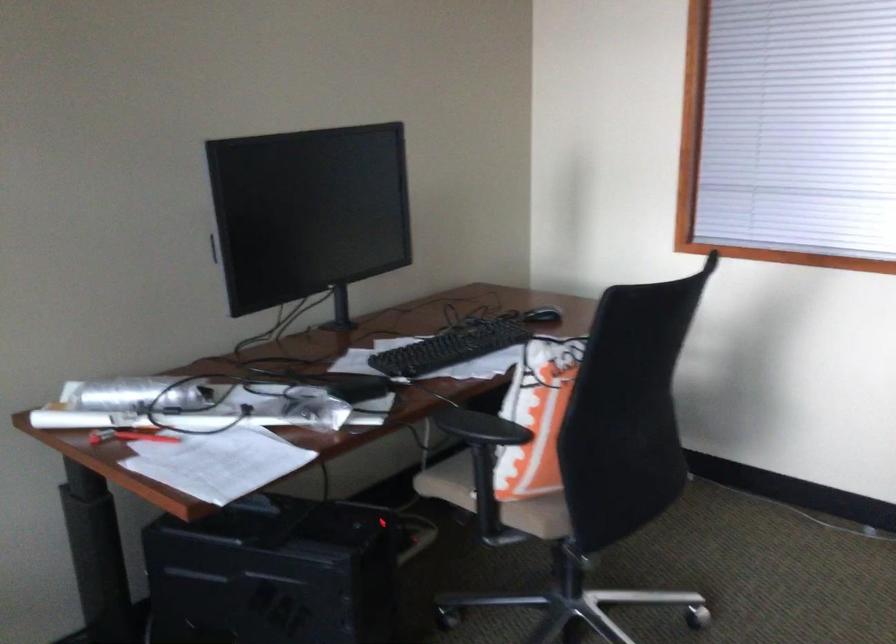
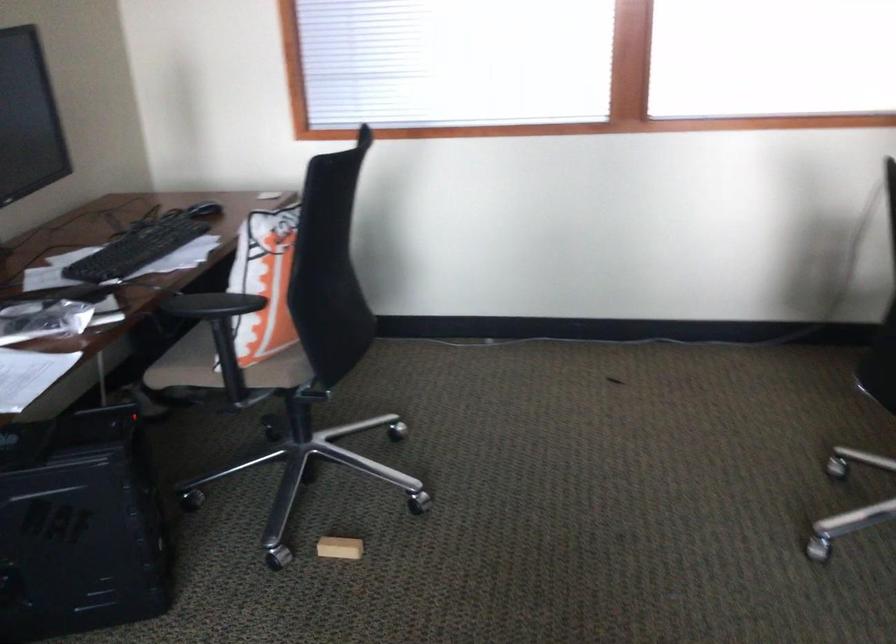
Locate, in the second image, the point that corresponds to (469,429) in the first image.

(211, 305)